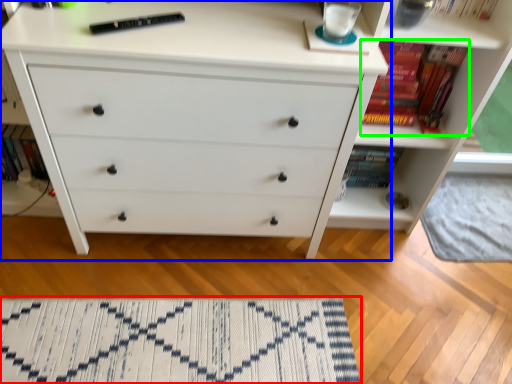
Question: Which is nearer to the mat (highlighted by a red box)? chest of drawers (highlighted by a blue box) or book (highlighted by a green box).

Choices:
 (A) chest of drawers
 (B) book

Answer: (A)